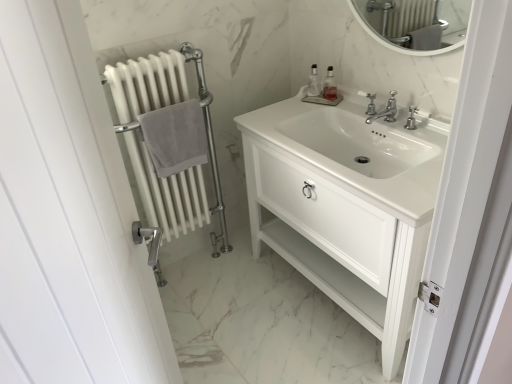
Question: Can you confirm if white matte radiator at left is positioned to the left of gray cotton towel at left?

Choices:
 (A) no
 (B) yes

Answer: (B)

Question: Is white matte radiator at left positioned before gray cotton towel at left?

Choices:
 (A) yes
 (B) no

Answer: (A)

Question: Does white matte radiator at left have a greater height compared to gray cotton towel at left?

Choices:
 (A) yes
 (B) no

Answer: (A)

Question: From a real-world perspective, is white matte radiator at left physically below gray cotton towel at left?

Choices:
 (A) yes
 (B) no

Answer: (A)

Question: Would you say white matte radiator at left contains gray cotton towel at left?

Choices:
 (A) yes
 (B) no

Answer: (A)

Question: Does white matte radiator at left have a lesser height compared to gray cotton towel at left?

Choices:
 (A) yes
 (B) no

Answer: (B)

Question: Does white glossy sink at center have a lesser width compared to white matte radiator at left?

Choices:
 (A) no
 (B) yes

Answer: (A)

Question: Could you tell me if white glossy sink at center is facing white matte radiator at left?

Choices:
 (A) no
 (B) yes

Answer: (A)

Question: Considering the relative sizes of white glossy sink at center and white matte radiator at left in the image provided, is white glossy sink at center bigger than white matte radiator at left?

Choices:
 (A) yes
 (B) no

Answer: (B)

Question: Is the depth of white glossy sink at center less than that of white matte radiator at left?

Choices:
 (A) yes
 (B) no

Answer: (A)

Question: Considering the relative sizes of white glossy sink at center and white matte radiator at left in the image provided, is white glossy sink at center shorter than white matte radiator at left?

Choices:
 (A) yes
 (B) no

Answer: (A)

Question: Can you confirm if white glossy sink at center is positioned to the left of white matte radiator at left?

Choices:
 (A) yes
 (B) no

Answer: (B)

Question: Is white glossy sink at center wider than translucent plastic soap dispenser at upper center, which appears as the first soap dispenser when viewed from the right?

Choices:
 (A) yes
 (B) no

Answer: (A)